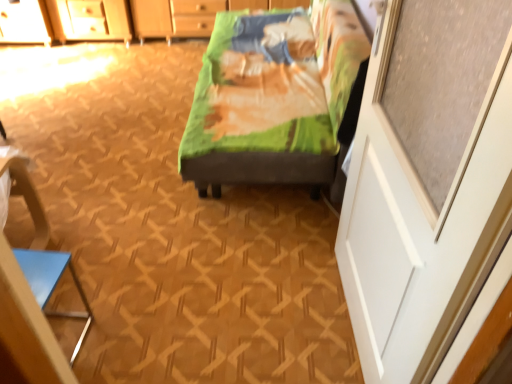
I want to click on free space between white matte screen door at right and green fabric bed at center, so click(x=276, y=277).